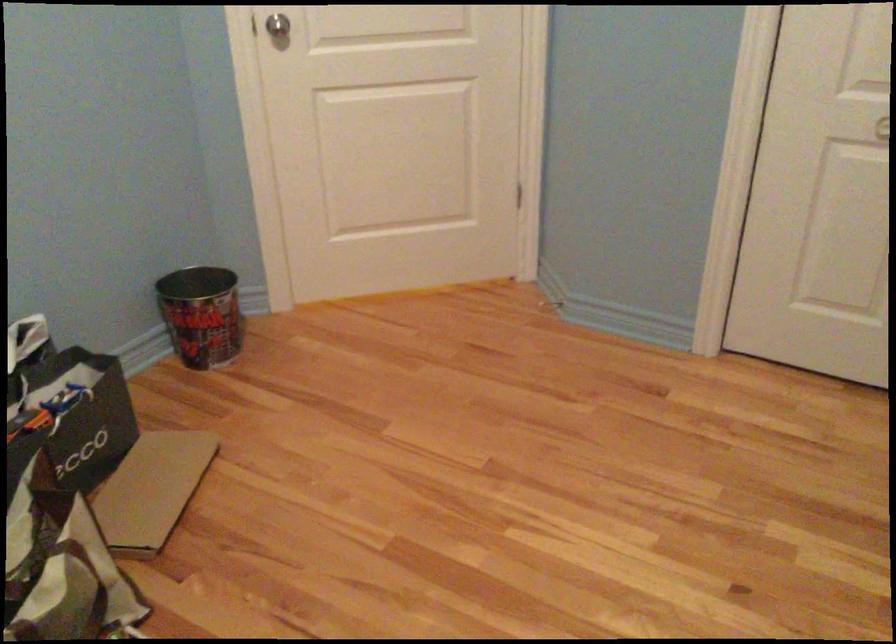
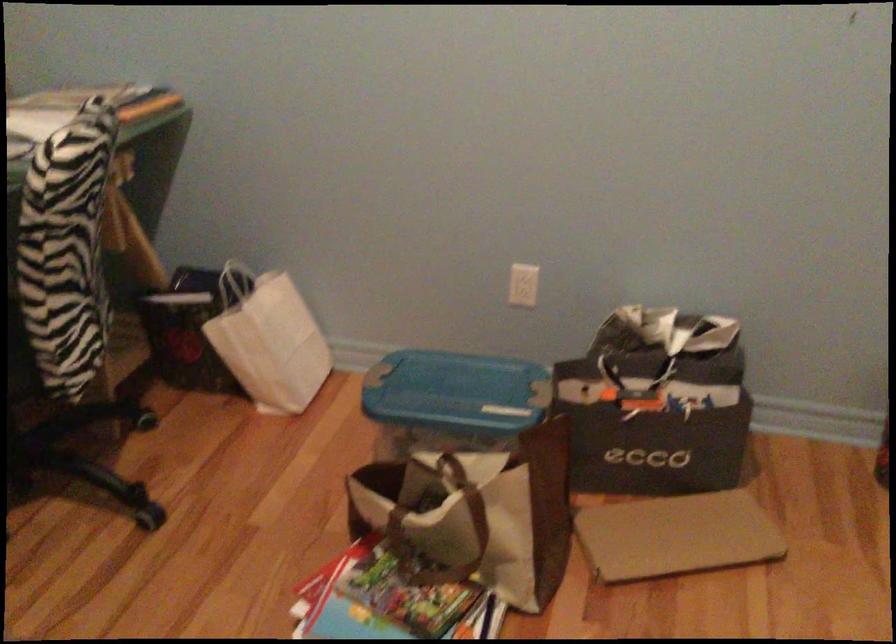
First-person continuous shooting, in which direction is the camera rotating?

The camera rotated toward left-down.